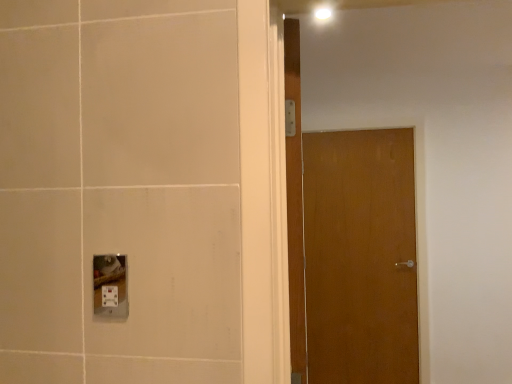
Question: From the image's perspective, relative to wooden door at center, arranged as the first door when viewed from the front, is white plastic socket at lower left above or below?

Choices:
 (A) below
 (B) above

Answer: (A)

Question: Considering the positions of white plastic socket at lower left and wooden door at center, the 1th door when ordered from left to right, in the image, is white plastic socket at lower left wider or thinner than wooden door at center, the 1th door when ordered from left to right,?

Choices:
 (A) wide
 (B) thin

Answer: (B)

Question: Which object is the closest to the white plastic socket at lower left?

Choices:
 (A) wooden door at center, arranged as the first door when viewed from the front
 (B) wooden door at center, which is the second door from front to back

Answer: (A)

Question: Based on their relative distances, which object is nearer to the wooden door at center, which ranks as the second door in back-to-front order?

Choices:
 (A) wooden door at center, which is the second door from front to back
 (B) white plastic socket at lower left

Answer: (B)